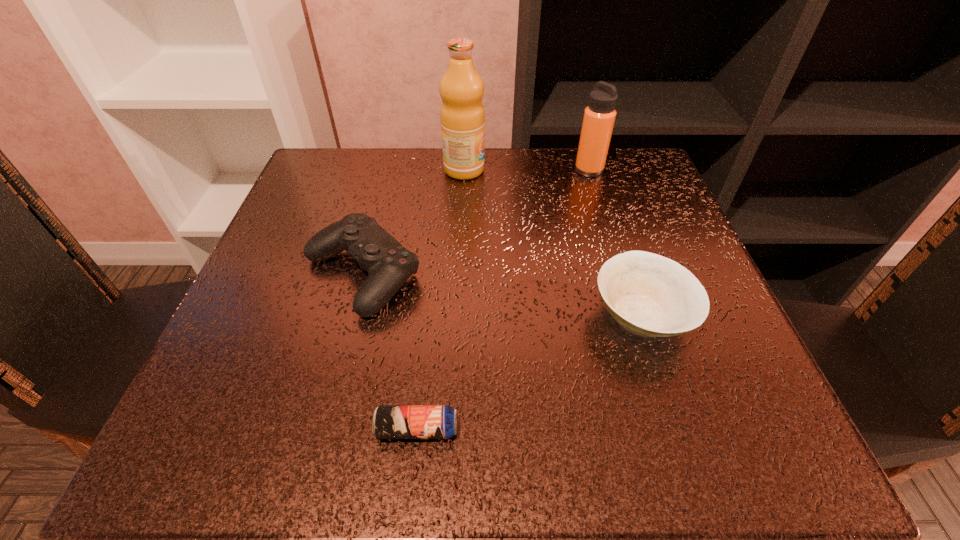
Locate an element on the screen. The height and width of the screenshot is (540, 960). free space at the right edge of the desktop is located at coordinates (713, 375).

Find the location of a particular element. vacant space at the far right corner is located at coordinates (637, 170).

Image resolution: width=960 pixels, height=540 pixels. I want to click on vacant region between the fruit juice and the bowl, so click(553, 243).

Find the location of a particular element. The height and width of the screenshot is (540, 960). free space between the thermos bottle and the control is located at coordinates (475, 222).

You are a GUI agent. You are given a task and a screenshot of the screen. Output one action in this format:
    pyautogui.click(x=<x>, y=<y>)
    Task: Click on the vacant area between the fourth shortest object and the beer can
    The height and width of the screenshot is (540, 960).
    Given the screenshot: What is the action you would take?
    pyautogui.click(x=503, y=300)

Find the location of `vacant area that lies between the bowl and the control`. vacant area that lies between the bowl and the control is located at coordinates (502, 295).

Where is `vacant area that lies between the control and the bowl`? This screenshot has width=960, height=540. vacant area that lies between the control and the bowl is located at coordinates (502, 295).

Locate an element on the screen. This screenshot has height=540, width=960. free space between the thermos bottle and the control is located at coordinates (475, 222).

This screenshot has width=960, height=540. Find the location of `unoccupied position between the bowl and the tallest object`. unoccupied position between the bowl and the tallest object is located at coordinates (553, 243).

Where is `free space between the control and the fruit juice`? free space between the control and the fruit juice is located at coordinates (413, 222).